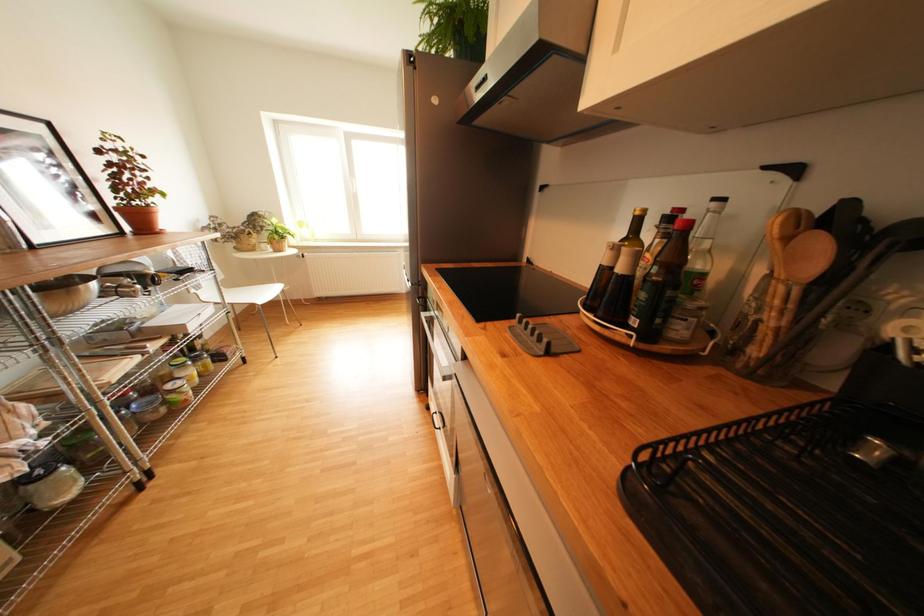
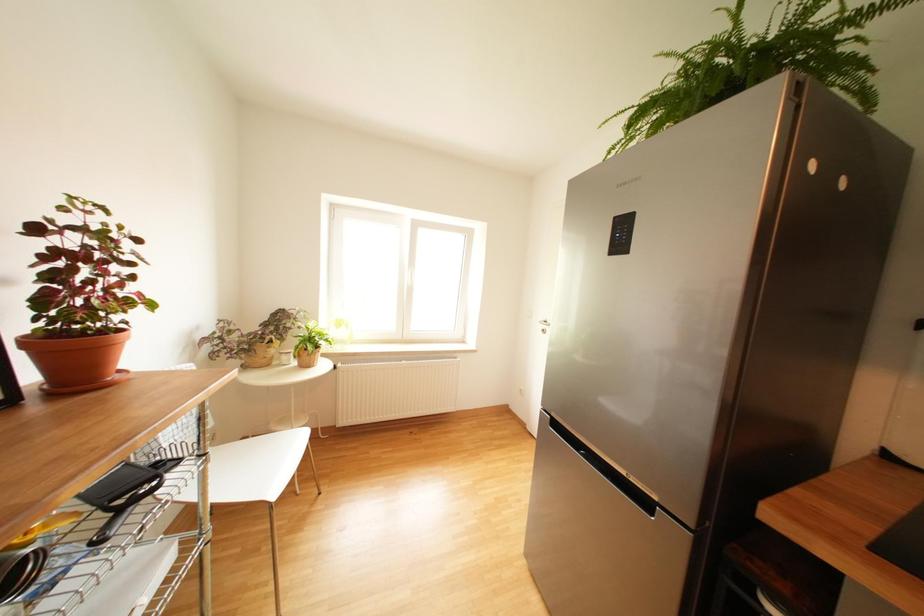
What movement of the cameraman would produce the second image?

The movement direction of the cameraman is left, forward.